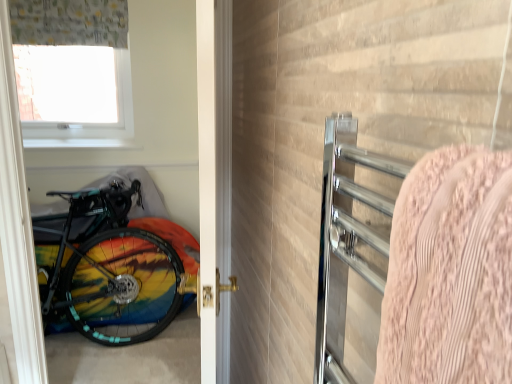
The width and height of the screenshot is (512, 384). What are the coordinates of `transparent plastic window screen at upper left` in the screenshot? It's located at (67, 83).

The height and width of the screenshot is (384, 512). Describe the element at coordinates (214, 183) in the screenshot. I see `white glossy door at center` at that location.

What is the approximate height of rainbow painted bicycle at left?

The height of rainbow painted bicycle at left is 30.49 inches.

This screenshot has width=512, height=384. Identify the location of pink textured towel at right. (450, 272).

Where is `bicycle located behind the pink textured towel at right`? The width and height of the screenshot is (512, 384). bicycle located behind the pink textured towel at right is located at coordinates (108, 268).

Based on the photo, is pink textured towel at right oriented away from rainbow painted bicycle at left?

pink textured towel at right is not turned away from rainbow painted bicycle at left.

Is point (435, 264) in front of point (180, 261)?

Yes, it is.

From the image's perspective, relative to rainbow painted bicycle at left, is pink textured towel at right above or below?

Clearly, from the image's perspective, pink textured towel at right is above rainbow painted bicycle at left.

Who is bigger, white glossy door at center or patterned fabric curtain at upper left?

With larger size is white glossy door at center.

From the image's perspective, is white glossy door at center on patterned fabric curtain at upper left?

Incorrect, from the image's perspective, white glossy door at center is lower than patterned fabric curtain at upper left.

Is white glossy door at center inside or outside of patterned fabric curtain at upper left?

white glossy door at center is spatially situated outside patterned fabric curtain at upper left.

This screenshot has width=512, height=384. I want to click on curtain behind the white glossy door at center, so click(69, 22).

Is patterned fabric curtain at upper left taller than white glossy door at center?

Incorrect, the height of patterned fabric curtain at upper left is not larger of that of white glossy door at center.

Is patterned fabric curtain at upper left wider than white glossy door at center?

Incorrect, the width of patterned fabric curtain at upper left does not surpass that of white glossy door at center.

From the image's perspective, which one is positioned higher, rainbow painted bicycle at left or white glossy door at center?

white glossy door at center is shown above in the image.

Which is less distant, (109, 203) or (209, 91)?

Point (109, 203) is positioned farther from the camera compared to point (209, 91).

Is rainbow painted bicycle at left to the left of white glossy door at center from the viewer's perspective?

Yes.

Considering the relative positions of patterned fabric curtain at upper left and pink textured towel at right in the image provided, is patterned fabric curtain at upper left behind pink textured towel at right?

Yes, patterned fabric curtain at upper left is behind pink textured towel at right.

From the image's perspective, is patterned fabric curtain at upper left located above or below pink textured towel at right?

patterned fabric curtain at upper left is situated higher than pink textured towel at right in the image.

Based on the photo, is patterned fabric curtain at upper left next to pink textured towel at right?

There is a gap between patterned fabric curtain at upper left and pink textured towel at right.

Is white glossy door at center not within pink textured towel at right?

Yes, white glossy door at center is outside of pink textured towel at right.

Identify the location of door behind the pink textured towel at right. (214, 183).

From the image's perspective, which one is positioned higher, white glossy door at center or pink textured towel at right?

pink textured towel at right appears higher in the image.

Is white glossy door at center smaller than pink textured towel at right?

No.

In terms of height, does pink textured towel at right look taller or shorter compared to white glossy door at center?

Considering their sizes, pink textured towel at right has less height than white glossy door at center.

In the image, is pink textured towel at right positioned in front of or behind white glossy door at center?

In the image, pink textured towel at right appears in front of white glossy door at center.

From a real-world perspective, does pink textured towel at right sit lower than white glossy door at center?

No, from a real-world perspective, pink textured towel at right is not under white glossy door at center.

Where is `blanket on the right of rainbow painted bicycle at left`? blanket on the right of rainbow painted bicycle at left is located at coordinates (450, 272).

The width and height of the screenshot is (512, 384). What are the coordinates of `curtain on the left of the white glossy door at center` in the screenshot? It's located at (69, 22).

When comparing their distances from transparent plastic window screen at upper left, does rainbow painted bicycle at left or white glossy door at center seem further?

Based on the image, white glossy door at center appears to be further to transparent plastic window screen at upper left.

Estimate the real-world distances between objects in this image. Which object is further from patterned fabric curtain at upper left, transparent plastic window screen at upper left or pink textured towel at right?

The object further to patterned fabric curtain at upper left is pink textured towel at right.

Which object lies further to the anchor point rainbow painted bicycle at left, pink textured towel at right or transparent plastic window screen at upper left?

pink textured towel at right.

Estimate the real-world distances between objects in this image. Which object is further from patterned fabric curtain at upper left, white glossy door at center or rainbow painted bicycle at left?

Among the two, white glossy door at center is located further to patterned fabric curtain at upper left.

Considering their positions, is rainbow painted bicycle at left positioned closer to patterned fabric curtain at upper left than transparent plastic window screen at upper left?

transparent plastic window screen at upper left.

When comparing their distances from white glossy door at center, does rainbow painted bicycle at left or pink textured towel at right seem closer?

rainbow painted bicycle at left lies closer to white glossy door at center than the other object.

From the picture: From the image, which object appears to be farther from transparent plastic window screen at upper left, pink textured towel at right or rainbow painted bicycle at left?

Among the two, pink textured towel at right is located further to transparent plastic window screen at upper left.

Which object lies further to the anchor point white glossy door at center, patterned fabric curtain at upper left or transparent plastic window screen at upper left?

The object further to white glossy door at center is transparent plastic window screen at upper left.

At what (x,y) coordinates should I click in order to perform the action: click on door located between pink textured towel at right and transparent plastic window screen at upper left in the depth direction. Please return your answer as a coordinate pair (x, y). Looking at the image, I should click on (214, 183).

Locate an element on the screen. curtain positioned between white glossy door at center and transparent plastic window screen at upper left from near to far is located at coordinates (69, 22).

Locate an element on the screen. curtain between pink textured towel at right and rainbow painted bicycle at left along the z-axis is located at coordinates (69, 22).

Locate an element on the screen. The height and width of the screenshot is (384, 512). bicycle positioned between pink textured towel at right and transparent plastic window screen at upper left from near to far is located at coordinates (108, 268).